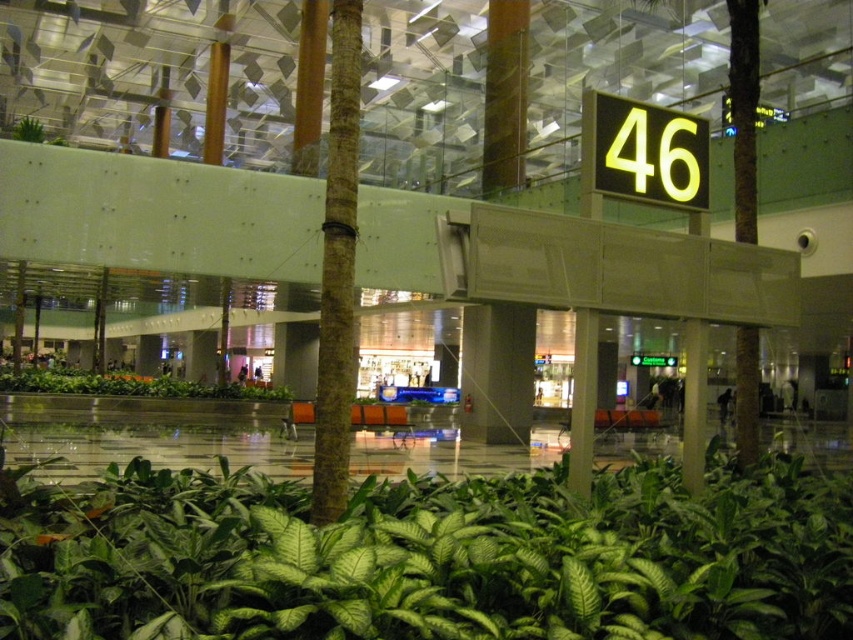
From the picture: You are a passenger sitting on one of the orange benches in the midground of the airport terminal. You notice two groups of green leafy plants in the foreground. Which group is closer to you? The green leafy plant at center or the green leafy plants at center?

The green leafy plant at center is closer to you because it is positioned over the green leafy plants at center, indicating it is in front.